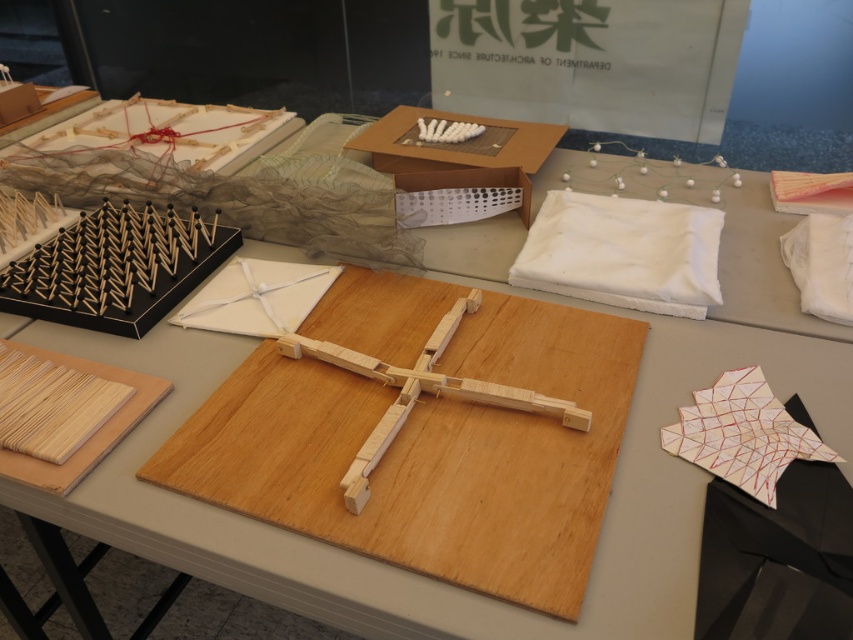
You are standing in front of the table and want to pick up an object. If you first reach for the object at point (537, 241) and then the one at point (498, 164), which point will require your hand to move upward more?

The point at (498, 164) will require your hand to move upward more because it is farther from the camera compared to point (537, 241), which is closer.